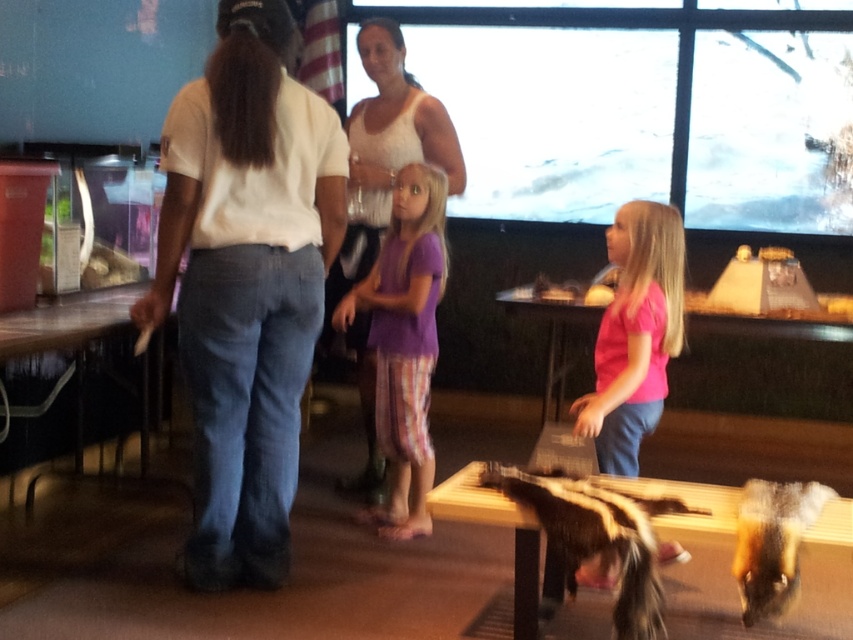
Between purple cotton shirt at center and fluffy brown and black skunk at center, which one appears on the right side from the viewer's perspective?

fluffy brown and black skunk at center is more to the right.

Who is more forward, (440, 180) or (775, 483)?

Point (775, 483)

Who is more distant from viewer, (428, 524) or (785, 609)?

Point (428, 524)

This screenshot has width=853, height=640. I want to click on purple cotton shirt at center, so click(x=404, y=340).

Looking at this image, is striped fur skunk at lower center below fluffy brown and black skunk at center?

Correct, striped fur skunk at lower center is located below fluffy brown and black skunk at center.

Who is more forward, [630,493] or [750,577]?

Point [750,577]

Locate an element on the screen. This screenshot has width=853, height=640. striped fur skunk at lower center is located at coordinates (596, 536).

Does point (769, 595) lie in front of point (137, 292)?

Yes, point (769, 595) is closer to viewer.

Does point (764, 586) lie in front of point (144, 433)?

Yes, point (764, 586) is in front of point (144, 433).

Where is `fluffy brown and black skunk at center`? Image resolution: width=853 pixels, height=640 pixels. fluffy brown and black skunk at center is located at coordinates (772, 541).